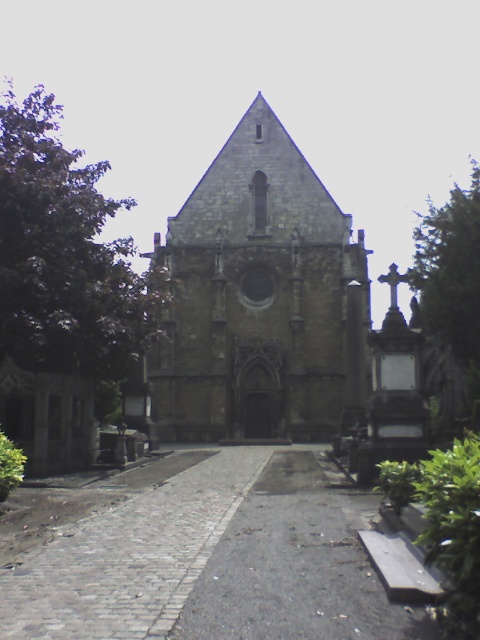
Question: Which point appears closest to the camera in this image?

Choices:
 (A) (310, 323)
 (B) (194, 611)

Answer: (B)

Question: From the image, what is the correct spatial relationship of cobblestone path at center in relation to stone gothic church at center?

Choices:
 (A) above
 (B) below

Answer: (B)

Question: Among these points, which one is nearest to the camera?

Choices:
 (A) (205, 561)
 (B) (304, 243)

Answer: (A)

Question: Which of the following is the farthest from the observer?

Choices:
 (A) (111, 528)
 (B) (308, 301)

Answer: (B)

Question: Can you confirm if cobblestone path at center is positioned to the left of stone gothic church at center?

Choices:
 (A) yes
 (B) no

Answer: (A)

Question: Is the position of cobblestone path at center more distant than that of stone gothic church at center?

Choices:
 (A) yes
 (B) no

Answer: (B)